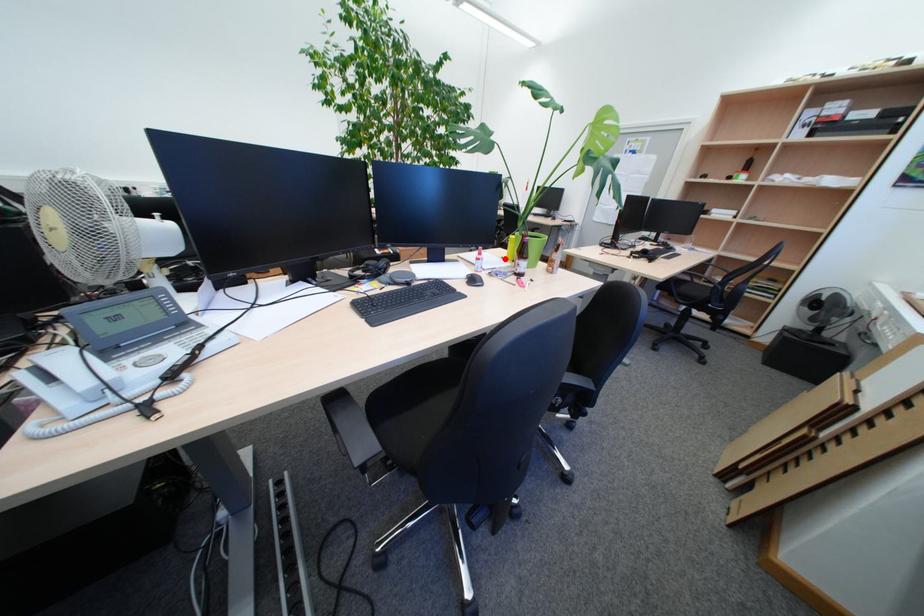
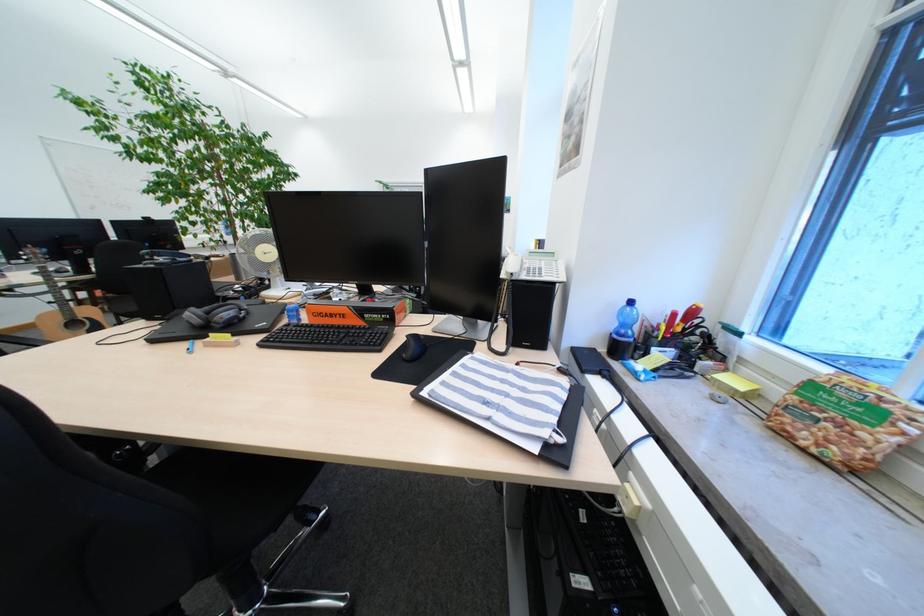
Question: I am providing you with two images of the same scene from different viewpoints. A red point is marked on the first image. At the location where the point appears in image 1, is it still visible in image 2?

Choices:
 (A) Yes
 (B) No

Answer: (B)